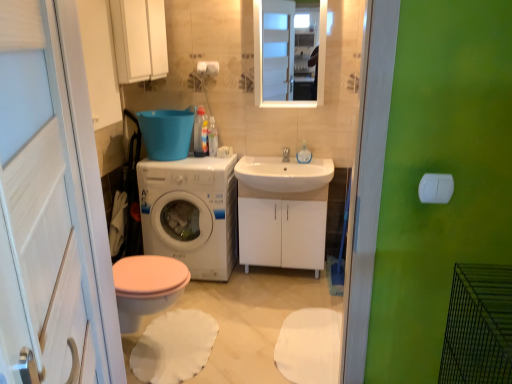
Question: Is white glossy cabinet at center taller or shorter than white matte toilet paper at center?

Choices:
 (A) short
 (B) tall

Answer: (B)

Question: Does point (262, 220) appear closer or farther from the camera than point (206, 74)?

Choices:
 (A) closer
 (B) farther

Answer: (A)

Question: Considering the real-world distances, which object is closest to the white glossy sink at center?

Choices:
 (A) white glossy cabinet at center
 (B) teal plastic bucket at center
 (C) white glossy sink at center
 (D) white glossy medicine cabinet at upper center
 (E) white glossy washing machine at center

Answer: (A)

Question: Estimate the real-world distances between objects in this image. Which object is closer to the white glossy sink at center?

Choices:
 (A) teal plastic bucket at center
 (B) white glossy cabinet at upper center
 (C) white glossy medicine cabinet at upper center
 (D) white glossy screen door at left
 (E) white glossy cabinet at center

Answer: (E)